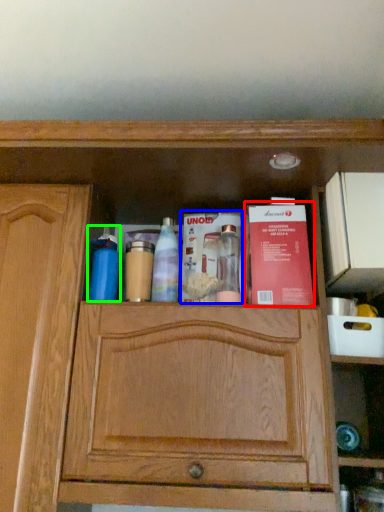
Question: Which is nearer to the book (highlighted by a red box)? book (highlighted by a blue box) or cleaning product (highlighted by a green box).

Choices:
 (A) book
 (B) cleaning product

Answer: (A)